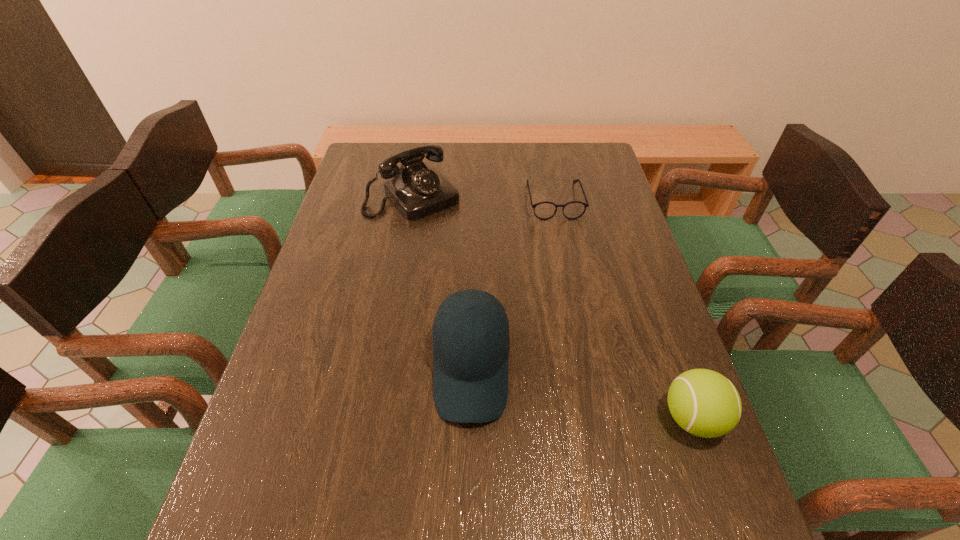
The height and width of the screenshot is (540, 960). In order to click on free spot on the desktop that is between the baseball cap and the tennis ball and is positioned on the front-facing side of the third object from left to right in this screenshot , I will do `click(600, 397)`.

Where is `vacant spot on the desktop that is between the baseball cap and the tennis ball and is positioned on the dial of the telephone`? This screenshot has width=960, height=540. vacant spot on the desktop that is between the baseball cap and the tennis ball and is positioned on the dial of the telephone is located at coordinates (589, 395).